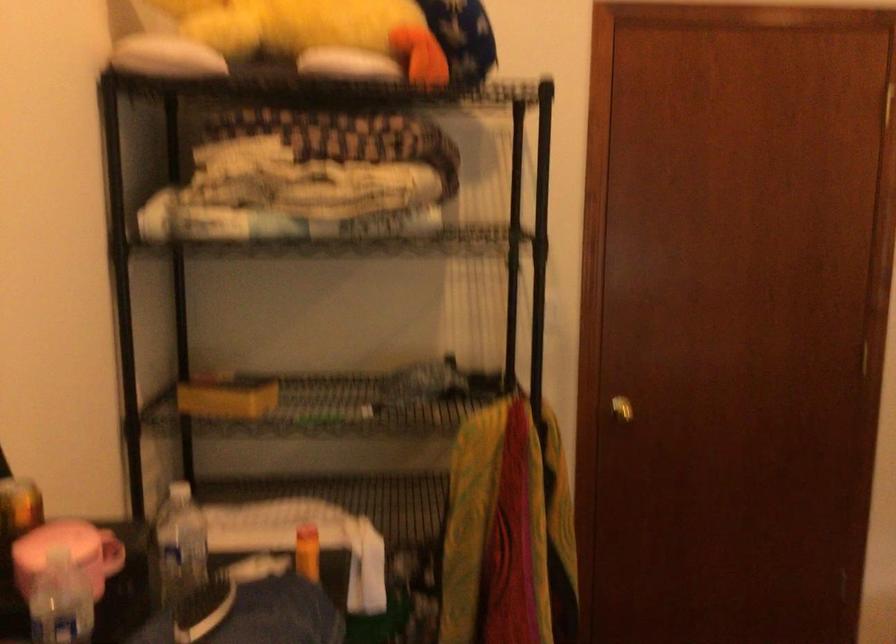
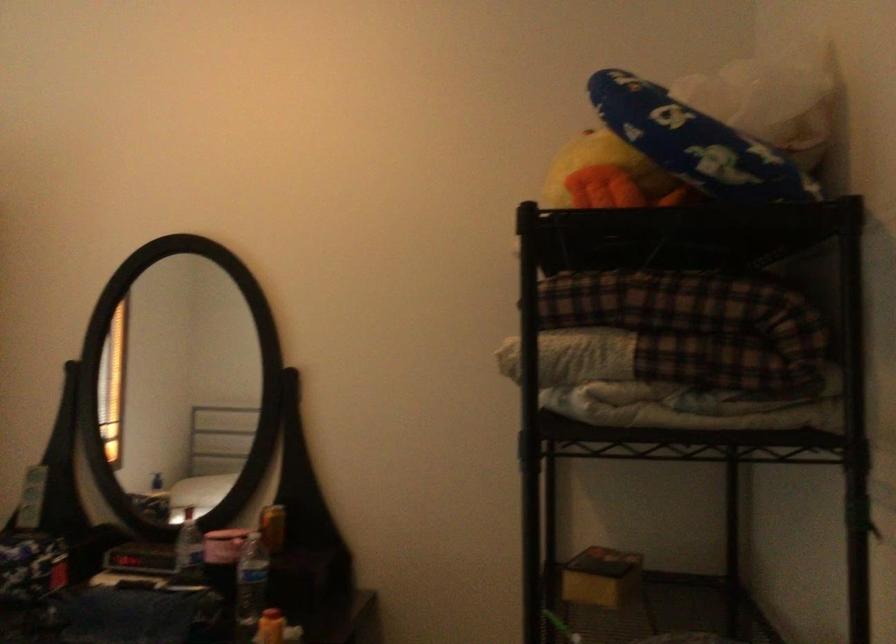
Find the pixel in the second image that matches point 194,562 in the first image.

(250, 585)